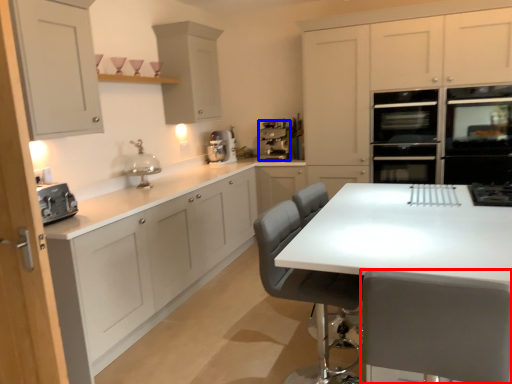
Question: Among these objects, which one is farthest to the camera, chair (highlighted by a red box) or appliance (highlighted by a blue box)?

Choices:
 (A) chair
 (B) appliance

Answer: (B)